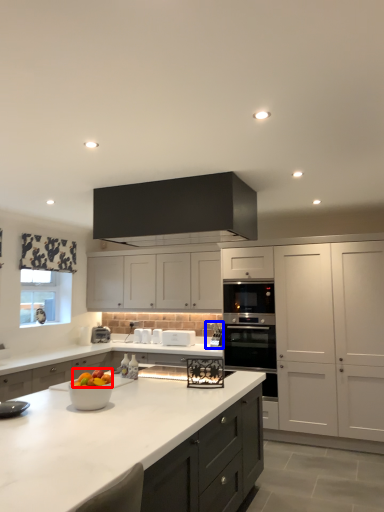
Question: Which object appears farthest to the camera in this image, fruit (highlighted by a red box) or appliance (highlighted by a blue box)?

Choices:
 (A) fruit
 (B) appliance

Answer: (B)